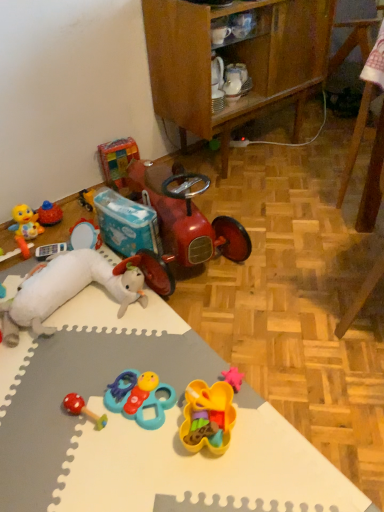
This screenshot has width=384, height=512. Identify the location of empty space that is in between wooden cabinet at center and shiny red toy car at center. (277, 197).